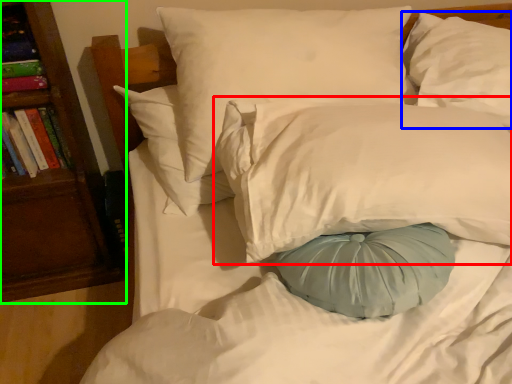
Question: Which object is positioned closest to pillow (highlighted by a red box)? Select from pillow (highlighted by a blue box) and bookshelf (highlighted by a green box).

Choices:
 (A) pillow
 (B) bookshelf

Answer: (A)